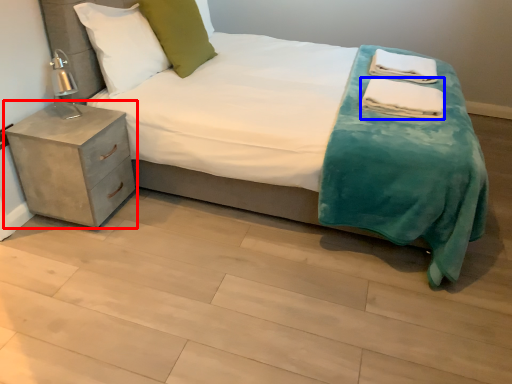
Question: Which point is closer to the camera, nightstand (highlighted by a red box) or material (highlighted by a blue box)?

Choices:
 (A) nightstand
 (B) material

Answer: (A)